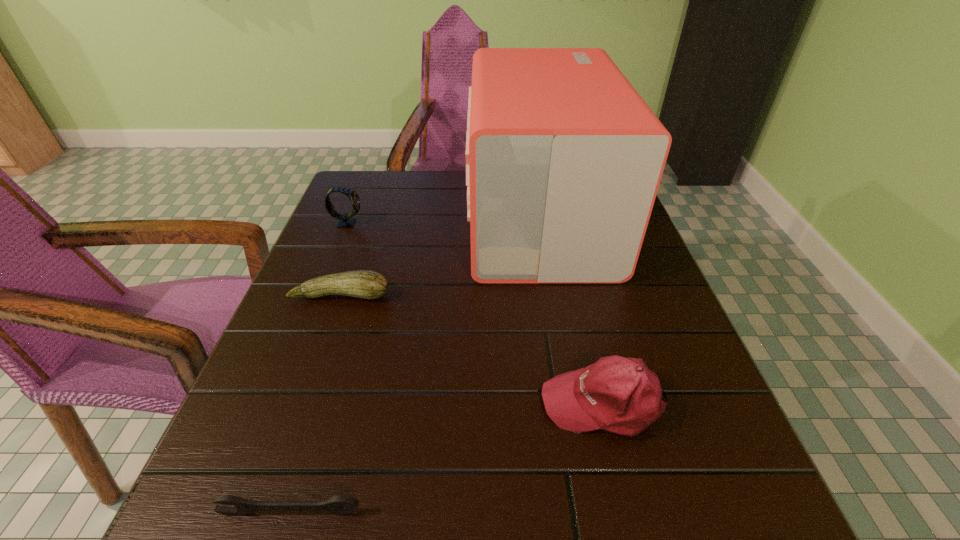
Where is `box that is at the right edge`? The width and height of the screenshot is (960, 540). box that is at the right edge is located at coordinates (564, 158).

At what (x,y) coordinates should I click in order to perform the action: click on baseball cap at the right edge. Please return your answer as a coordinate pair (x, y). Looking at the image, I should click on (621, 395).

Identify the location of object located in the near left corner section of the desktop. (339, 505).

Locate an element on the screen. Image resolution: width=960 pixels, height=540 pixels. object situated at the far right corner is located at coordinates (564, 158).

Identify the location of vacant space at the far edge. (453, 197).

Locate an element on the screen. blank area at the near edge is located at coordinates 640,507.

In the image, there is a desktop. Where is `vacant space at the left edge`? vacant space at the left edge is located at coordinates (350, 235).

The height and width of the screenshot is (540, 960). I want to click on vacant area at the right edge of the desktop, so click(644, 276).

You are a GUI agent. You are given a task and a screenshot of the screen. Output one action in this format:
    pyautogui.click(x=<x>, y=<y>)
    Task: Click on the blank space at the far left corner of the desktop
    
    Given the screenshot: What is the action you would take?
    pyautogui.click(x=383, y=200)

The height and width of the screenshot is (540, 960). I want to click on unoccupied position between the second nearest object and the tallest object, so click(571, 310).